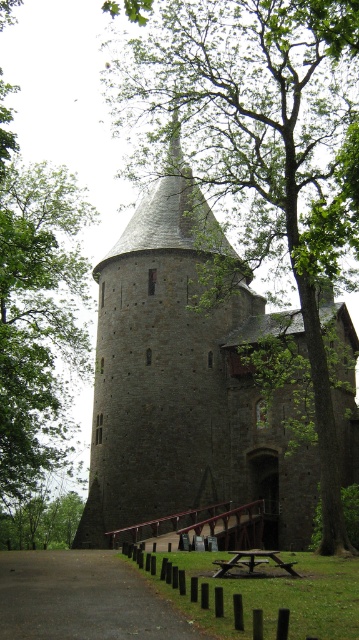
You are standing in front of the medieval stone tower and notice two green leafy trees in the scene. Which of the two trees, the green leafy tree at left or the green leafy tree at lower left, appears taller?

The green leafy tree at left appears taller than the green leafy tree at lower left.

You are standing at the base of the medieval stone tower and notice a point marked at coordinates [36,310]. Based on the scene description, what object or feature is located at this point?

The point at coordinates [36,310] corresponds to a green leafy tree at the left side of the scene.

You are standing in the lush green landscape and want to take a photo of the dark gray stone tower at center and the green leafy tree at lower left. Which object should you point your camera towards first to capture both in the frame?

The dark gray stone tower at center is above the green leafy tree at lower left, so you should point your camera towards the green leafy tree at lower left first to ensure both are in the frame.